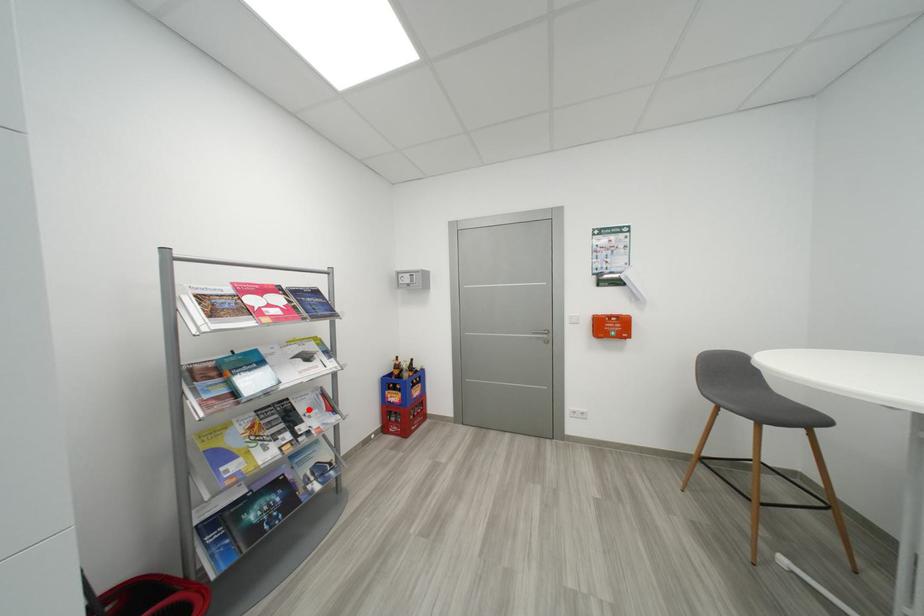
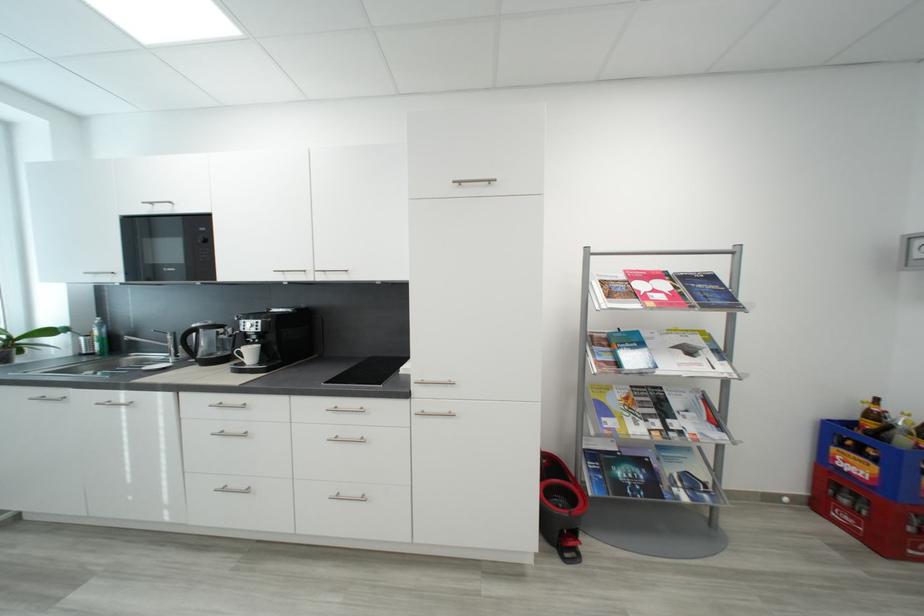
Question: I am providing you with two images of the same scene from different viewpoints. A red point is marked on the first image. Is the red point's position out of view in image 2?

Choices:
 (A) Yes
 (B) No

Answer: (B)